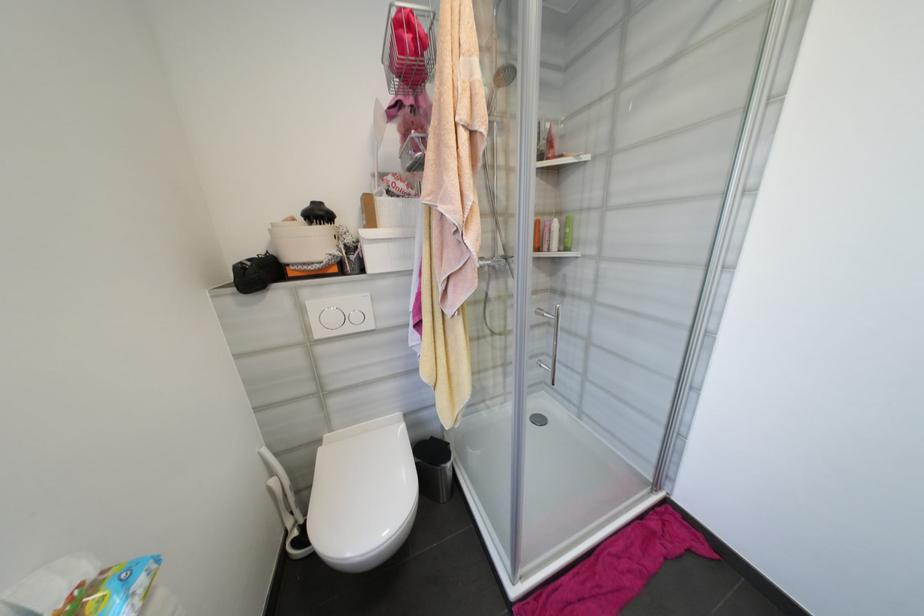
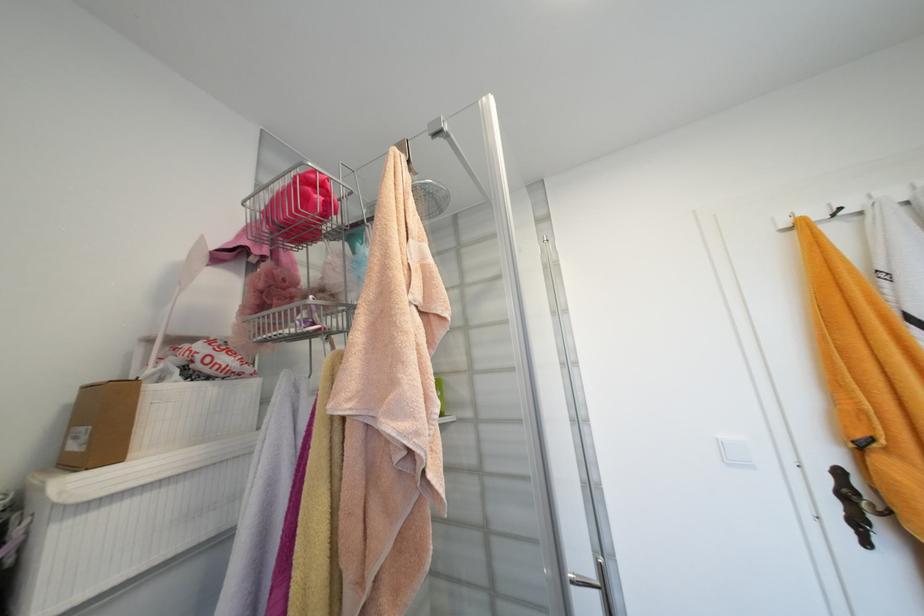
First-person continuous shooting, in which direction is the camera rotating?

The camera rotated toward right-up.